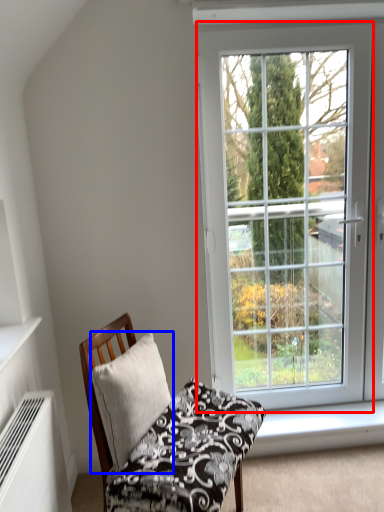
Question: Among these objects, which one is farthest to the camera, window (highlighted by a red box) or pillow (highlighted by a blue box)?

Choices:
 (A) window
 (B) pillow

Answer: (A)